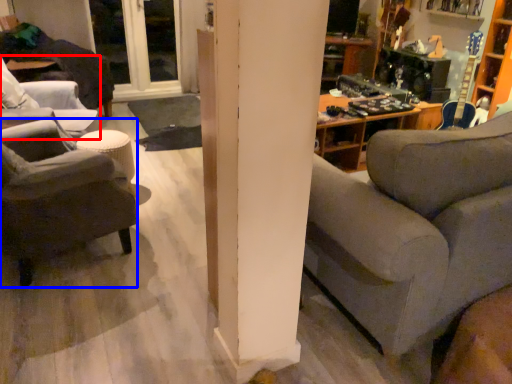
Question: Which object is further to the camera taking this photo, chair (highlighted by a red box) or chair (highlighted by a blue box)?

Choices:
 (A) chair
 (B) chair

Answer: (A)